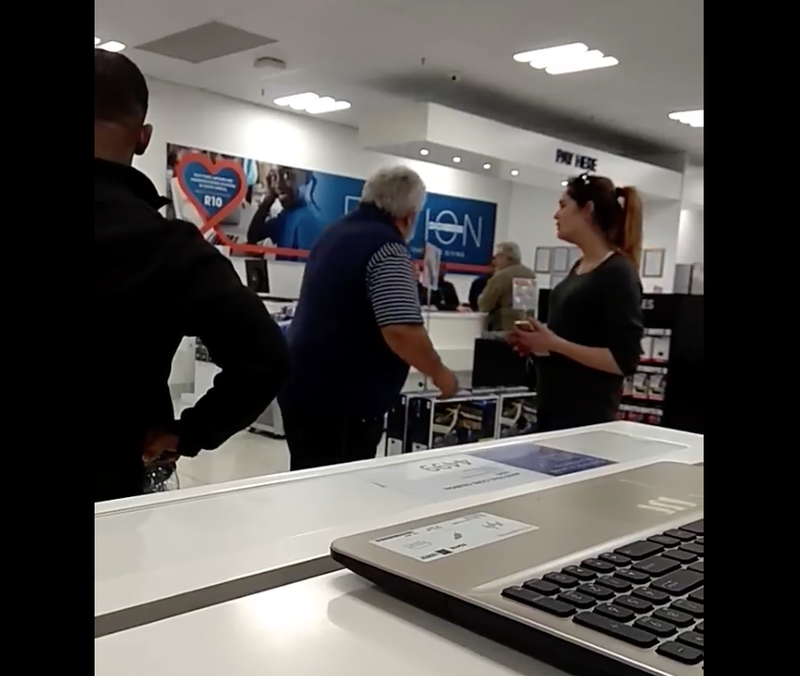
This screenshot has height=676, width=800. What are the coordinates of `laptop` in the screenshot? It's located at (510, 562).